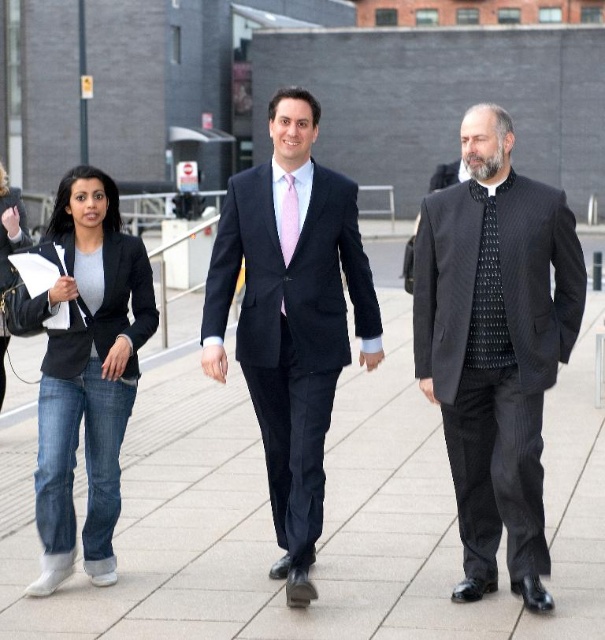
Can you confirm if black pinstripe suit at center is taller than matte black suit at center?

In fact, black pinstripe suit at center may be shorter than matte black suit at center.

Is point (500, 179) positioned before point (312, 324)?

Yes, point (500, 179) is in front of point (312, 324).

Identify the location of black pinstripe suit at center. This screenshot has height=640, width=605. (495, 346).

Looking at this image, is matte black suit at center to the right of black textured tie at center from the viewer's perspective?

No, matte black suit at center is not to the right of black textured tie at center.

The height and width of the screenshot is (640, 605). What are the coordinates of `matte black suit at center` in the screenshot? It's located at tap(290, 321).

Is point (318, 387) positioned before point (488, 301)?

No, it is behind (488, 301).

Locate an element on the screen. matte black suit at center is located at coordinates (290, 321).

Can you confirm if paved stone pavement at center is positioned above denim jacket at left?

No, paved stone pavement at center is not above denim jacket at left.

Can you confirm if paved stone pavement at center is bigger than denim jacket at left?

Yes.

Does point (580, 538) come closer to viewer compared to point (10, 284)?

Yes, it is.

Locate an element on the screen. paved stone pavement at center is located at coordinates (324, 515).